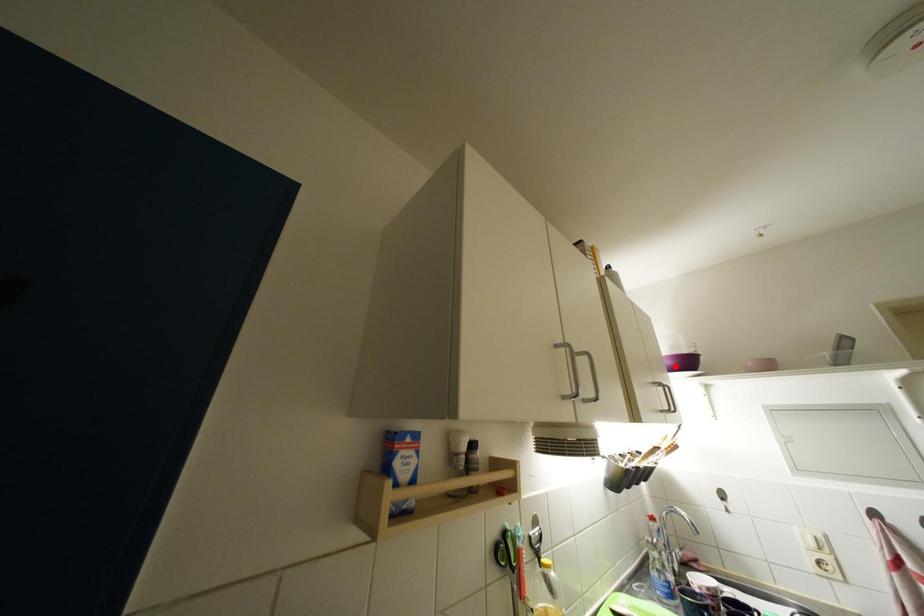
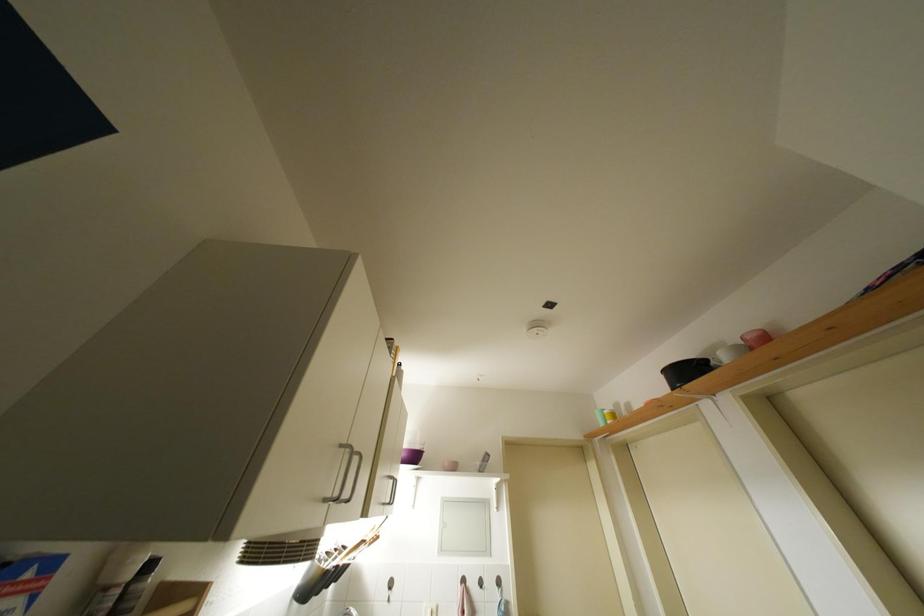
Question: I am providing you with two images of the same scene from different viewpoints. A red point is marked on the first image. Can you still see the location of the red point in image 2?

Choices:
 (A) Yes
 (B) No

Answer: (A)